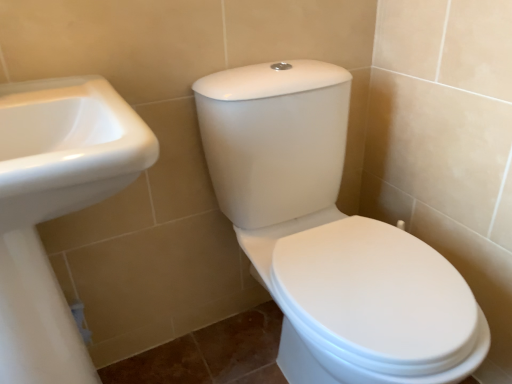
Question: From a real-world perspective, is white glossy sink at left below white glossy toilet at center?

Choices:
 (A) no
 (B) yes

Answer: (A)

Question: Is the surface of white glossy sink at left in direct contact with white glossy toilet at center?

Choices:
 (A) no
 (B) yes

Answer: (A)

Question: Is white glossy sink at left far away from white glossy toilet at center?

Choices:
 (A) no
 (B) yes

Answer: (A)

Question: Can you confirm if white glossy sink at left is taller than white glossy toilet at center?

Choices:
 (A) no
 (B) yes

Answer: (B)

Question: From the image's perspective, is white glossy sink at left located above white glossy toilet at center?

Choices:
 (A) yes
 (B) no

Answer: (B)

Question: Is white glossy sink at left smaller than white glossy toilet at center?

Choices:
 (A) yes
 (B) no

Answer: (A)

Question: Is white glossy toilet at center facing away from white glossy sink at left?

Choices:
 (A) no
 (B) yes

Answer: (A)

Question: Can you confirm if white glossy toilet at center is taller than white glossy sink at left?

Choices:
 (A) yes
 (B) no

Answer: (B)

Question: Could you tell me if white glossy toilet at center is facing white glossy sink at left?

Choices:
 (A) yes
 (B) no

Answer: (B)

Question: Is white glossy sink at left completely or partially inside white glossy toilet at center?

Choices:
 (A) yes
 (B) no

Answer: (B)

Question: Does white glossy toilet at center have a greater width compared to white glossy sink at left?

Choices:
 (A) no
 (B) yes

Answer: (B)

Question: Does white glossy toilet at center appear on the left side of white glossy sink at left?

Choices:
 (A) yes
 (B) no

Answer: (B)

Question: Looking at the image, does white glossy toilet at center seem bigger or smaller compared to white glossy sink at left?

Choices:
 (A) big
 (B) small

Answer: (A)